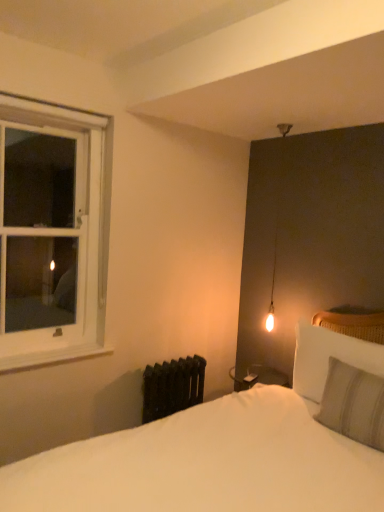
What are the coordinates of `vacant area on top of white painted wood at left (from a real-world perspective)` in the screenshot? It's located at (53, 347).